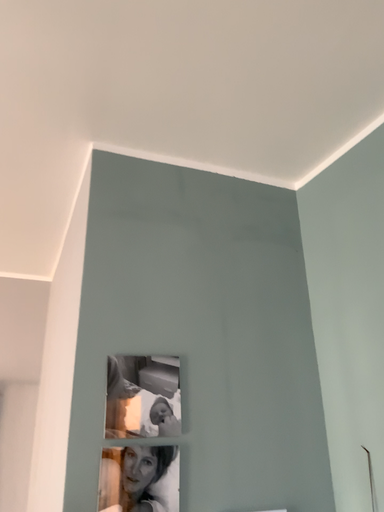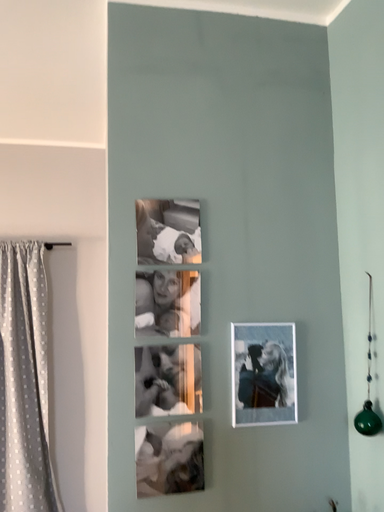
Question: How did the camera likely rotate when shooting the video?

Choices:
 (A) rotated left
 (B) rotated right

Answer: (A)